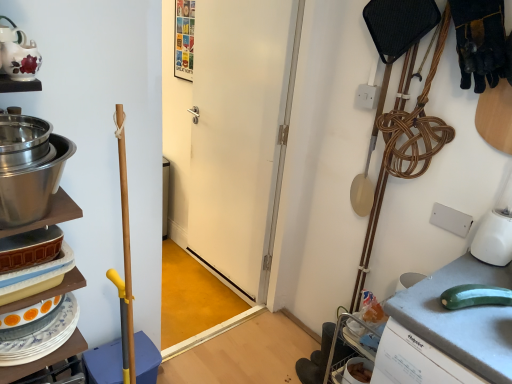
Question: Does stainless steel bowl at left have a larger size compared to matte ceramic teapot at upper left?

Choices:
 (A) no
 (B) yes

Answer: (B)

Question: Considering the relative sizes of stainless steel bowl at left and matte ceramic teapot at upper left in the image provided, is stainless steel bowl at left shorter than matte ceramic teapot at upper left?

Choices:
 (A) no
 (B) yes

Answer: (A)

Question: Is stainless steel bowl at left oriented away from matte ceramic teapot at upper left?

Choices:
 (A) no
 (B) yes

Answer: (A)

Question: Is stainless steel bowl at left surrounding matte ceramic teapot at upper left?

Choices:
 (A) no
 (B) yes

Answer: (A)

Question: Considering the relative sizes of stainless steel bowl at left and matte ceramic teapot at upper left in the image provided, is stainless steel bowl at left wider than matte ceramic teapot at upper left?

Choices:
 (A) yes
 (B) no

Answer: (A)

Question: In terms of height, does matte ceramic teapot at upper left look taller or shorter compared to white matte door at center?

Choices:
 (A) short
 (B) tall

Answer: (A)

Question: From a real-world perspective, is matte ceramic teapot at upper left above or below white matte door at center?

Choices:
 (A) below
 (B) above

Answer: (B)

Question: Based on their positions, is matte ceramic teapot at upper left located to the left or right of white matte door at center?

Choices:
 (A) right
 (B) left

Answer: (B)

Question: Relative to white matte door at center, is matte ceramic teapot at upper left in front or behind?

Choices:
 (A) behind
 (B) front

Answer: (B)

Question: From a real-world perspective, is stainless steel bowl at left above or below matte ceramic teapot at upper left?

Choices:
 (A) above
 (B) below

Answer: (B)

Question: In terms of height, does stainless steel bowl at left look taller or shorter compared to matte ceramic teapot at upper left?

Choices:
 (A) tall
 (B) short

Answer: (A)

Question: From the image's perspective, is stainless steel bowl at left positioned above or below matte ceramic teapot at upper left?

Choices:
 (A) below
 (B) above

Answer: (A)

Question: Based on their positions, is stainless steel bowl at left located to the left or right of matte ceramic teapot at upper left?

Choices:
 (A) left
 (B) right

Answer: (B)

Question: From a real-world perspective, relative to matte ceramic teapot at upper left, is white matte door at center vertically above or below?

Choices:
 (A) above
 (B) below

Answer: (B)

Question: From the image's perspective, is white matte door at center above or below matte ceramic teapot at upper left?

Choices:
 (A) above
 (B) below

Answer: (B)